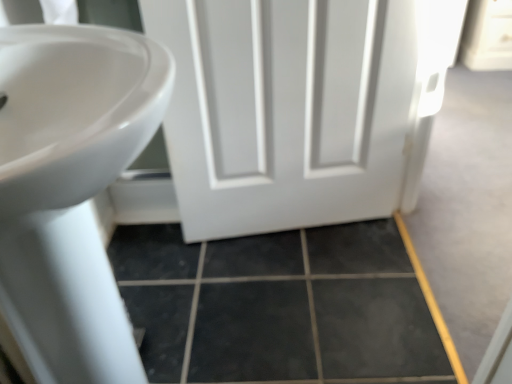
Image resolution: width=512 pixels, height=384 pixels. Describe the element at coordinates (279, 306) in the screenshot. I see `dark gray tile at lower center` at that location.

You are a GUI agent. You are given a task and a screenshot of the screen. Output one action in this format:
    pyautogui.click(x=<x>, y=<y>)
    Task: Click on the white glossy sink at left
    This screenshot has width=512, height=384.
    Given the screenshot: What is the action you would take?
    pyautogui.click(x=70, y=189)

I want to click on dark gray tile at lower center, so click(x=279, y=306).

Is dark gray tile at lower center with white matte door at center?

No, dark gray tile at lower center is not with white matte door at center.

From the image's perspective, is dark gray tile at lower center below white matte door at center?

Correct, dark gray tile at lower center appears lower than white matte door at center in the image.

Does dark gray tile at lower center have a greater width compared to white matte door at center?

Yes.

Are dark gray tile at lower center and white glossy sink at left making contact?

No, dark gray tile at lower center is not with white glossy sink at left.

Which is behind, point (206, 316) or point (105, 96)?

The point (206, 316) is behind.

How different are the orientations of dark gray tile at lower center and white glossy sink at left in degrees?

The angle between the facing direction of dark gray tile at lower center and the facing direction of white glossy sink at left is 1.3 degrees.

Does dark gray tile at lower center come in front of white glossy sink at left?

No, it is not.

Does white matte door at center have a greater height compared to dark gray tile at lower center?

Yes, white matte door at center is taller than dark gray tile at lower center.

From a real-world perspective, is white matte door at center positioned above or below dark gray tile at lower center?

Clearly, from a real-world perspective, white matte door at center is above dark gray tile at lower center.

From the picture: From the image's perspective, which is below, white matte door at center or dark gray tile at lower center?

From the image's view, dark gray tile at lower center is below.

Is dark gray tile at lower center at the back of white matte door at center?

No, white matte door at center is not facing the opposite direction of dark gray tile at lower center.

Does white glossy sink at left have a smaller size compared to white matte door at center?

Actually, white glossy sink at left might be larger than white matte door at center.

Is white glossy sink at left far away from white matte door at center?

white glossy sink at left is actually quite close to white matte door at center.

Is white glossy sink at left completely or partially outside of white matte door at center?

Yes, white glossy sink at left is not within white matte door at center.

Which of these two, white glossy sink at left or white matte door at center, is thinner?

white matte door at center is thinner.

Is white matte door at center positioned behind white glossy sink at left?

Yes, it is behind white glossy sink at left.

Does white matte door at center turn towards white glossy sink at left?

Yes, white matte door at center is facing white glossy sink at left.

Identify the location of sink to the left of white matte door at center. (70, 189).

What's the angular difference between white matte door at center and white glossy sink at left's facing directions?

They differ by 82.4 degrees in their facing directions.

Considering the sizes of objects white glossy sink at left and dark gray tile at lower center in the image provided, who is bigger, white glossy sink at left or dark gray tile at lower center?

white glossy sink at left is bigger.

Can you tell me how much white glossy sink at left and dark gray tile at lower center differ in facing direction?

The facing directions of white glossy sink at left and dark gray tile at lower center are 1.3 degrees apart.

Which is in front, point (63, 188) or point (180, 238)?

The point (63, 188) is closer to the camera.

Which is correct: white glossy sink at left is inside dark gray tile at lower center, or outside of it?

white glossy sink at left is outside dark gray tile at lower center.

This screenshot has height=384, width=512. Identify the location of tile below the white matte door at center (from the image's perspective). [279, 306].

Image resolution: width=512 pixels, height=384 pixels. I want to click on sink in front of the dark gray tile at lower center, so click(70, 189).

From the image, which object appears to be farther from white matte door at center, white glossy sink at left or dark gray tile at lower center?

Based on the image, white glossy sink at left appears to be further to white matte door at center.

Looking at the image, which one is located closer to white glossy sink at left, white matte door at center or dark gray tile at lower center?

dark gray tile at lower center lies closer to white glossy sink at left than the other object.

Based on their spatial positions, is white matte door at center or white glossy sink at left further from dark gray tile at lower center?

white glossy sink at left lies further to dark gray tile at lower center than the other object.

When comparing their distances from white matte door at center, does dark gray tile at lower center or white glossy sink at left seem closer?

Based on the image, dark gray tile at lower center appears to be nearer to white matte door at center.

Consider the image. Which object lies nearer to the anchor point dark gray tile at lower center, white glossy sink at left or white matte door at center?

white matte door at center is closer to dark gray tile at lower center.

Considering their positions, is dark gray tile at lower center positioned further to white glossy sink at left than white matte door at center?

white matte door at center.

What are the coordinates of `door between white glossy sink at left and dark gray tile at lower center in the front-back direction` in the screenshot? It's located at (286, 110).